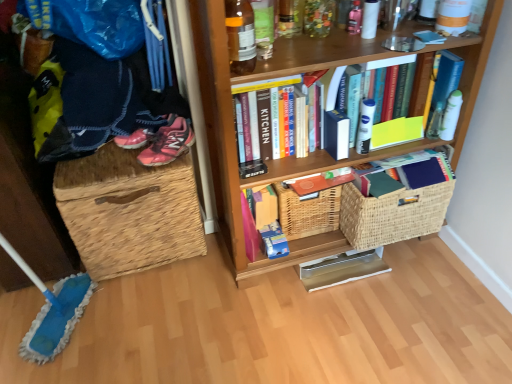
Find the location of `free space that is in between wooden bookcase at right and metallic gold book at lower center, the first book from the bottom`. free space that is in between wooden bookcase at right and metallic gold book at lower center, the first book from the bottom is located at coordinates (386, 260).